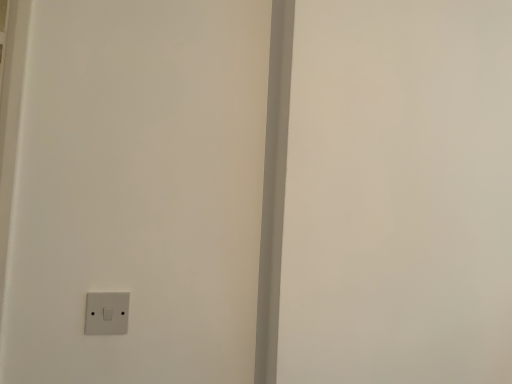
Describe the element at coordinates (106, 313) in the screenshot. I see `white plastic light switch at lower left` at that location.

Measure the distance between point [109,314] and camera.

Point [109,314] is 35.67 inches away from camera.

This screenshot has height=384, width=512. I want to click on white plastic light switch at lower left, so click(106, 313).

Where is `white plastic light switch at lower left`? white plastic light switch at lower left is located at coordinates [x=106, y=313].